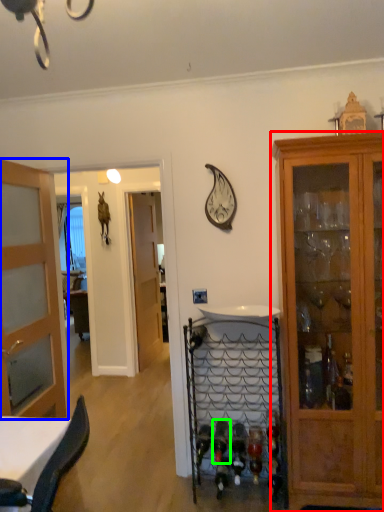
Question: Based on their relative distances, which object is farther from cabinetry (highlighted by a red box)? Choose from door (highlighted by a blue box) and wine bottle (highlighted by a green box).

Choices:
 (A) door
 (B) wine bottle

Answer: (A)